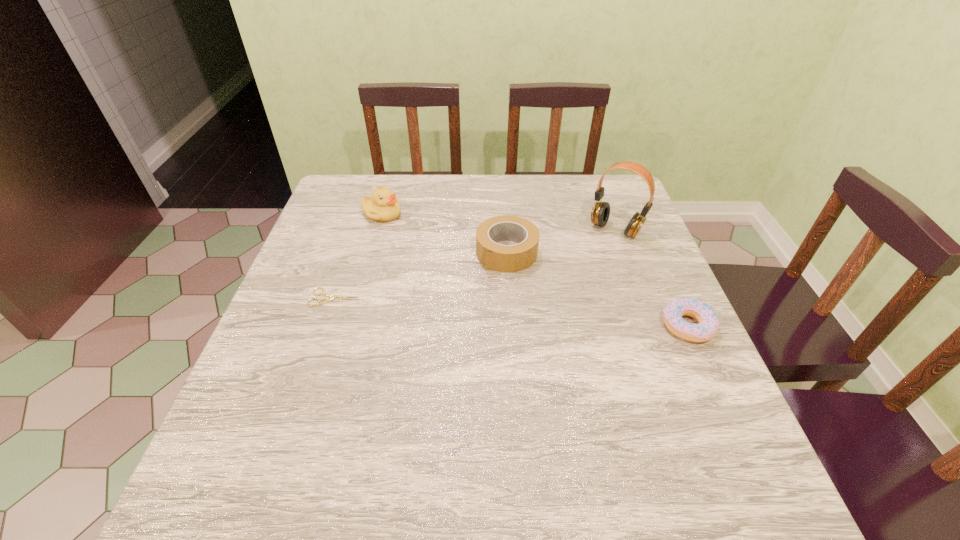
I want to click on free space on the desktop that is between the second nearest object and the nearest object and is positioned on the beak of the duckling, so click(477, 309).

Identify the location of free space on the desktop that is between the shortest object and the doughnut and is positioned on the ear cups of the headset. Image resolution: width=960 pixels, height=540 pixels. (551, 315).

Find the location of `vacant space on the desktop that is between the shortest object and the fourth tallest object and is positioned at the edge of the duct tape`. vacant space on the desktop that is between the shortest object and the fourth tallest object and is positioned at the edge of the duct tape is located at coordinates (454, 307).